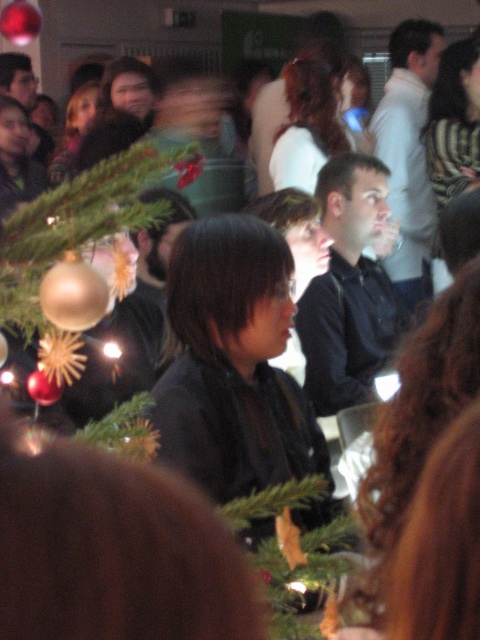
Based on the photo, you are a photographer at the event and want to take a photo of the gold metallic ornament at center. Where should you position your camera to capture it best?

The gold metallic ornament at center is located at coordinates 0.375 on the x axis and 0.156 on the y axis. Position the camera directly facing those coordinates for optimal capture.

You are attending a festive indoor event and want to take a photo of both the point at coordinates (139, 184) and the point at coordinates (336, 614). Considering their positions, which point is nearer to you?

The point at coordinates (139, 184) is closer to the viewer than the point at coordinates (336, 614).